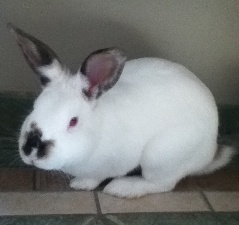
Where is `grout`? grout is located at coordinates (98, 213), (212, 209).